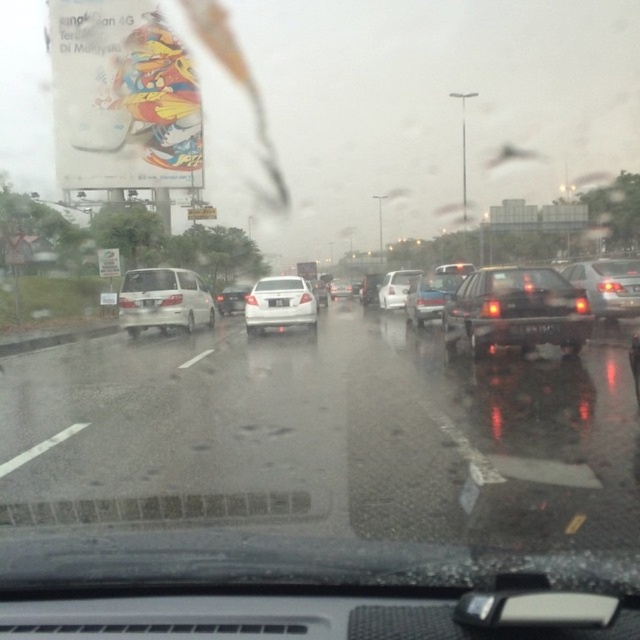
Question: Based on their relative distances, which object is farther from the satin silver minivan at left?

Choices:
 (A) shiny black sedan at center
 (B) white matte sedan at center

Answer: (A)

Question: Estimate the real-world distances between objects in this image. Which object is closer to the satin silver sedan at right?

Choices:
 (A) satin silver sedan at center
 (B) white glossy sedan at center

Answer: (A)

Question: Is shiny blue sedan at center positioned in front of satin silver sedan at center?

Choices:
 (A) yes
 (B) no

Answer: (A)

Question: Does satin silver sedan at right have a greater width compared to white matte car at center?

Choices:
 (A) no
 (B) yes

Answer: (B)

Question: Can you confirm if satin silver sedan at right is thinner than white matte sedan at center?

Choices:
 (A) no
 (B) yes

Answer: (A)

Question: Considering the real-world distances, which object is closest to the matte black suv at center?

Choices:
 (A) white matte car at center
 (B) shiny blue sedan at center

Answer: (B)